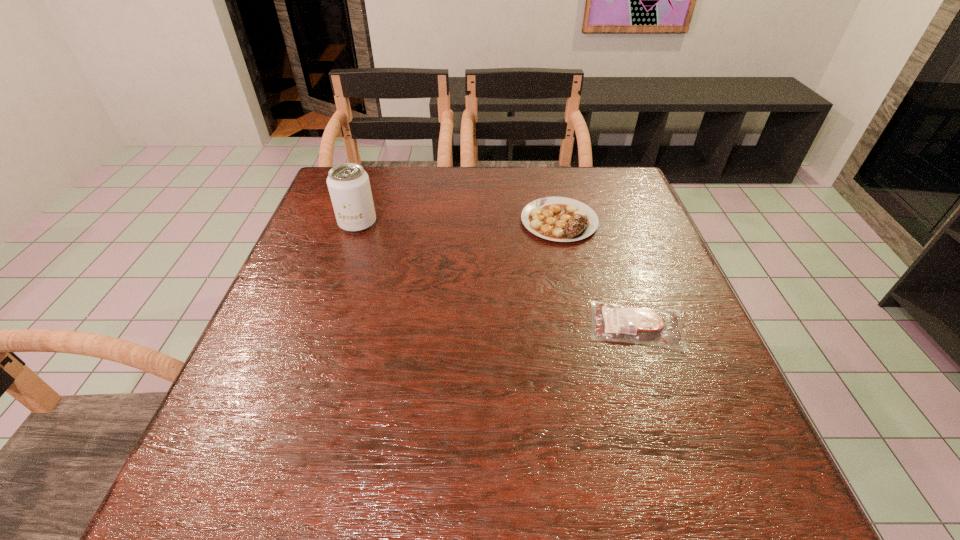
Locate an element on the screen. The height and width of the screenshot is (540, 960). free spot that satisfies the following two spatial constraints: 1. on the front side of the second tallest object; 2. on the right side of the shorter steak is located at coordinates (583, 326).

The height and width of the screenshot is (540, 960). I want to click on free location that satisfies the following two spatial constraints: 1. on the back side of the leftmost object; 2. on the right side of the farther steak, so click(x=358, y=221).

Locate an element on the screen. Image resolution: width=960 pixels, height=540 pixels. free spot that satisfies the following two spatial constraints: 1. on the front side of the nearest object; 2. on the left side of the leftmost object is located at coordinates (323, 326).